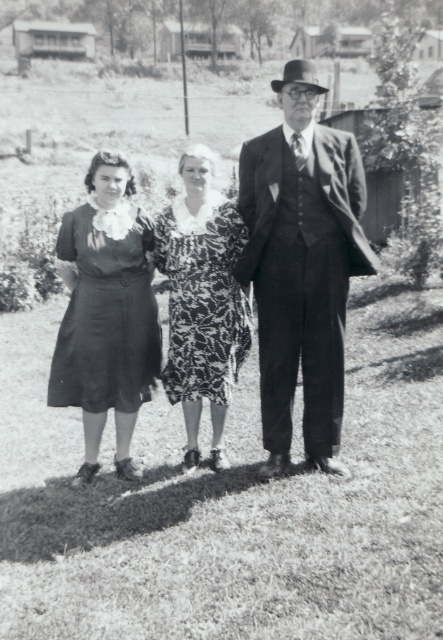
You are a photographer reviewing this black and white photo and want to place a label on the matte black dress at center and the smooth black suit at center. According to the image, which one is positioned to the left?

The matte black dress at center is positioned to the left of the smooth black suit at center.